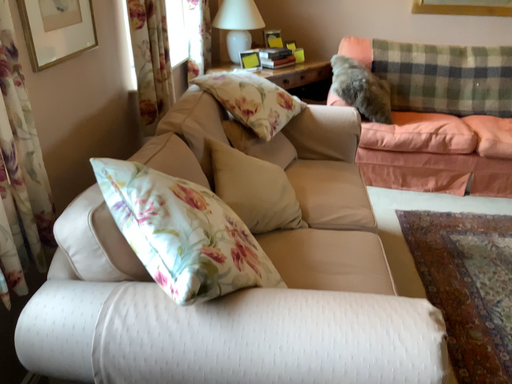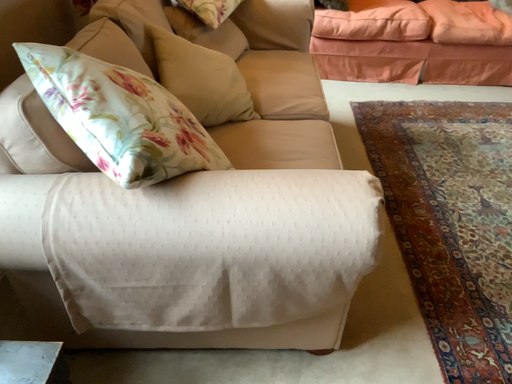
Question: Which way did the camera rotate in the video?

Choices:
 (A) rotated upward
 (B) rotated downward

Answer: (B)